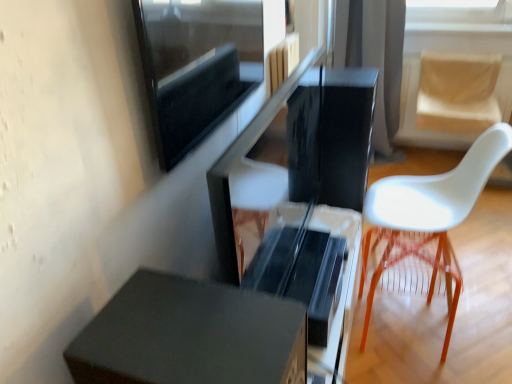
Locate an element on the screen. The width and height of the screenshot is (512, 384). vacant space to the right of translucent orange stool at right is located at coordinates (480, 335).